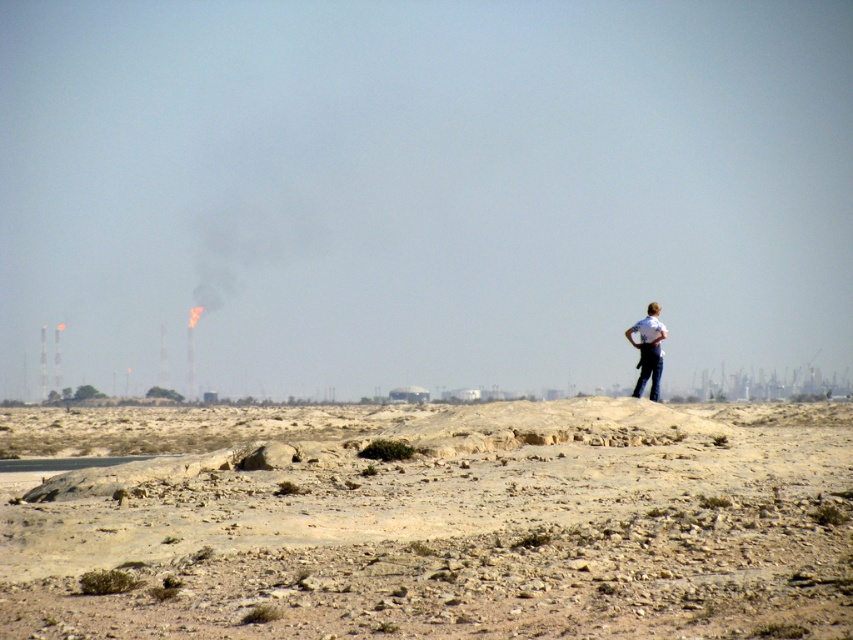
Question: Which of the following is the closest to the observer?

Choices:
 (A) dull brown dirt at center
 (B) white shirt at upper right

Answer: (A)

Question: Can you confirm if dull brown dirt at center is bigger than white shirt at upper right?

Choices:
 (A) no
 (B) yes

Answer: (B)

Question: Can you confirm if dull brown dirt at center is wider than white shirt at upper right?

Choices:
 (A) yes
 (B) no

Answer: (A)

Question: Is dull brown dirt at center bigger than white shirt at upper right?

Choices:
 (A) yes
 (B) no

Answer: (A)

Question: Which of the following is the farthest from the observer?

Choices:
 (A) white shirt at upper right
 (B) dull brown dirt at center

Answer: (A)